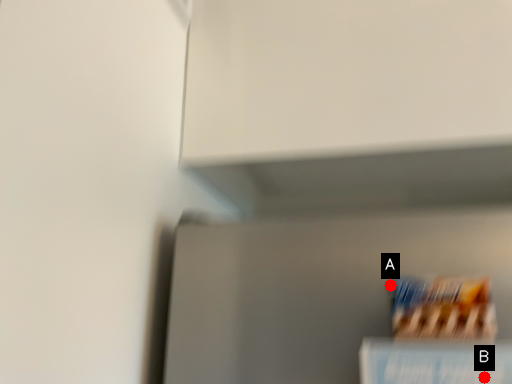
Question: Two points are circled on the image, labeled by A and B beside each circle. Which point is closer to the camera?

Choices:
 (A) A is closer
 (B) B is closer

Answer: (B)